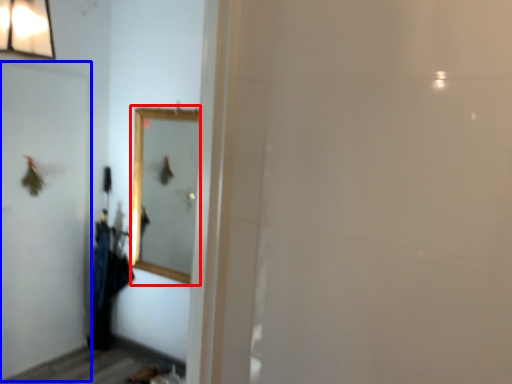
Question: Which of the following is the closest to the observer, mirror (highlighted by a red box) or screen door (highlighted by a blue box)?

Choices:
 (A) mirror
 (B) screen door

Answer: (B)